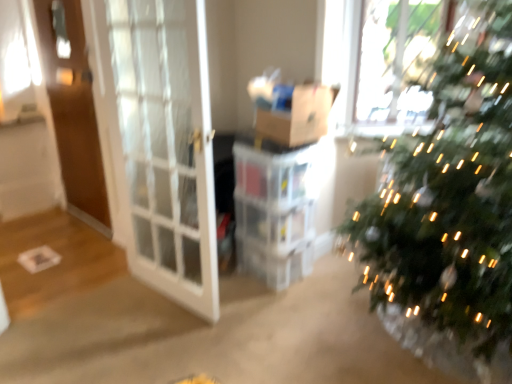
Question: From the image's perspective, is white glass screen door at left, which appears as the first screen door when viewed from the front, positioned above or below brown cardboard box at center?

Choices:
 (A) above
 (B) below

Answer: (B)

Question: From their relative heights in the image, would you say white glass screen door at left, arranged as the second screen door when viewed from the back, is taller or shorter than brown cardboard box at center?

Choices:
 (A) tall
 (B) short

Answer: (A)

Question: Which object is the closest to the brown cardboard box at center?

Choices:
 (A) white glass screen door at left, which is the second screen door from left to right
 (B) brown wooden screen door at left, acting as the 1th screen door starting from the back

Answer: (A)

Question: Considering the real-world distances, which object is farthest from the brown cardboard box at center?

Choices:
 (A) brown wooden screen door at left, placed as the 1th screen door when sorted from left to right
 (B) white glass screen door at left, arranged as the second screen door when viewed from the back

Answer: (A)